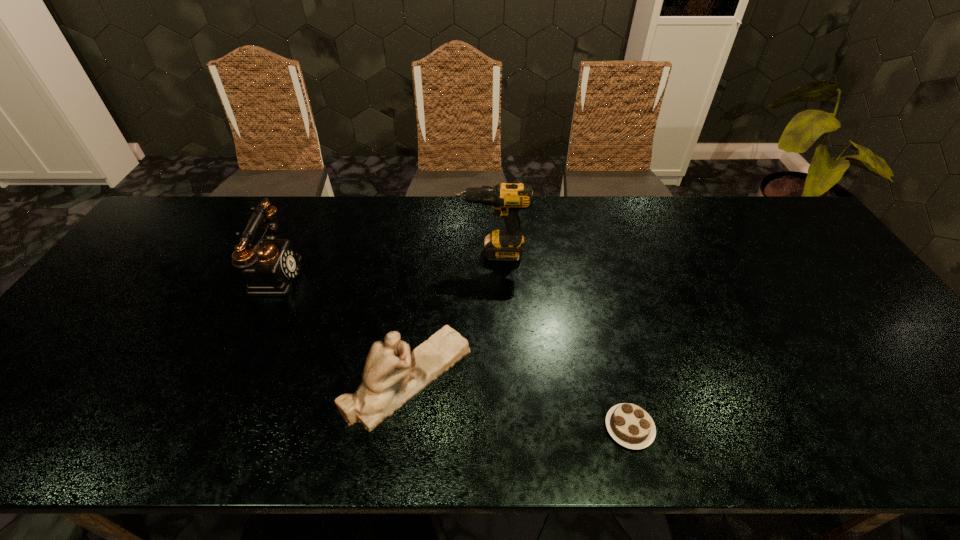
The height and width of the screenshot is (540, 960). In order to click on empty location between the drill and the telephone in this screenshot , I will do tap(383, 264).

Identify the location of free point between the rightmost object and the figurine. This screenshot has width=960, height=540. (519, 403).

In order to click on free space between the tallest object and the third tallest object in this screenshot , I will do [451, 315].

Find the location of a particular element. free space between the leftmost object and the tallest object is located at coordinates (383, 264).

The width and height of the screenshot is (960, 540). I want to click on free space between the drill and the third shortest object, so click(383, 264).

The image size is (960, 540). In order to click on empty space between the chocolate cake and the figurine in this screenshot , I will do `click(519, 403)`.

You are a GUI agent. You are given a task and a screenshot of the screen. Output one action in this format:
    pyautogui.click(x=<x>, y=<y>)
    Task: Click on the vacant space in between the chocolate cake and the third tallest object
    The width and height of the screenshot is (960, 540).
    Given the screenshot: What is the action you would take?
    pyautogui.click(x=519, y=403)

Locate an element on the screen. vacant region between the chocolate cake and the third tallest object is located at coordinates (519, 403).

Select which object appears as the closest to the tallest object. Please provide its 2D coordinates. Your answer should be formatted as a tuple, i.e. [(x, y)], where the tuple contains the x and y coordinates of a point satisfying the conditions above.

[(392, 376)]

I want to click on object that stands as the second closest to the drill, so click(x=270, y=268).